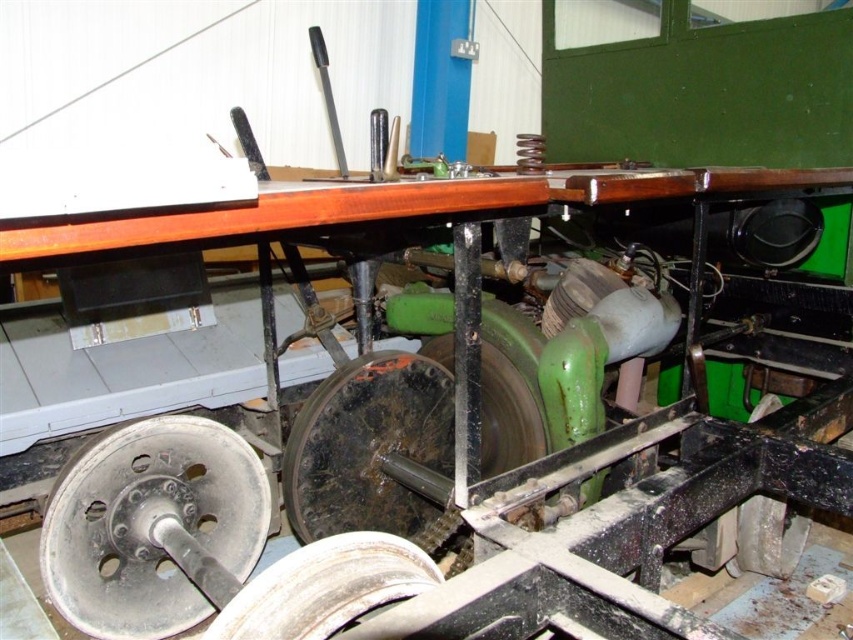
Question: Which object is farther from the camera taking this photo?

Choices:
 (A) black rubber wheel at lower right
 (B) gray metallic wheel at lower left
 (C) green rubber wheel at center
 (D) black rubber wheel at center

Answer: (A)

Question: Is the position of black rubber wheel at center more distant than that of white rubber wheel at center?

Choices:
 (A) yes
 (B) no

Answer: (A)

Question: Which point is closer to the camera?

Choices:
 (A) (316, 593)
 (B) (265, 480)

Answer: (A)

Question: Can you confirm if gray metallic wheel at lower left is thinner than white rubber wheel at center?

Choices:
 (A) no
 (B) yes

Answer: (A)

Question: Which point is farther to the camera?

Choices:
 (A) (254, 472)
 (B) (316, 436)

Answer: (A)

Question: Does black rubber wheel at center have a lesser width compared to black rubber wheel at lower right?

Choices:
 (A) no
 (B) yes

Answer: (A)